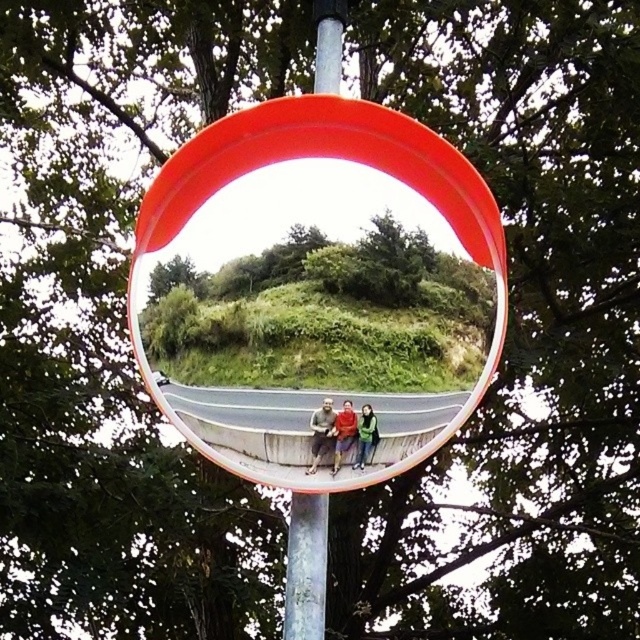
Is metallic gray pole at center taller than matte gray shirt at center?

Correct, metallic gray pole at center is much taller as matte gray shirt at center.

Which is above, metallic gray pole at center or matte gray shirt at center?

Positioned higher is matte gray shirt at center.

Is point (310, 582) positioned in front of point (326, 449)?

No.

Find the location of a particular element. This screenshot has width=640, height=640. metallic gray pole at center is located at coordinates (307, 566).

Between transparent plastic view mirror at center and red fabric jacket at center, which one appears on the left side from the viewer's perspective?

From the viewer's perspective, transparent plastic view mirror at center appears more on the left side.

Which of these two, transparent plastic view mirror at center or red fabric jacket at center, stands shorter?

With less height is red fabric jacket at center.

Image resolution: width=640 pixels, height=640 pixels. Identify the location of transparent plastic view mirror at center. pos(321,157).

Which is in front, point (225, 184) or point (308, 528)?

Point (225, 184) is in front.

Locate an element on the screen. This screenshot has height=640, width=640. transparent plastic view mirror at center is located at coordinates (321, 157).